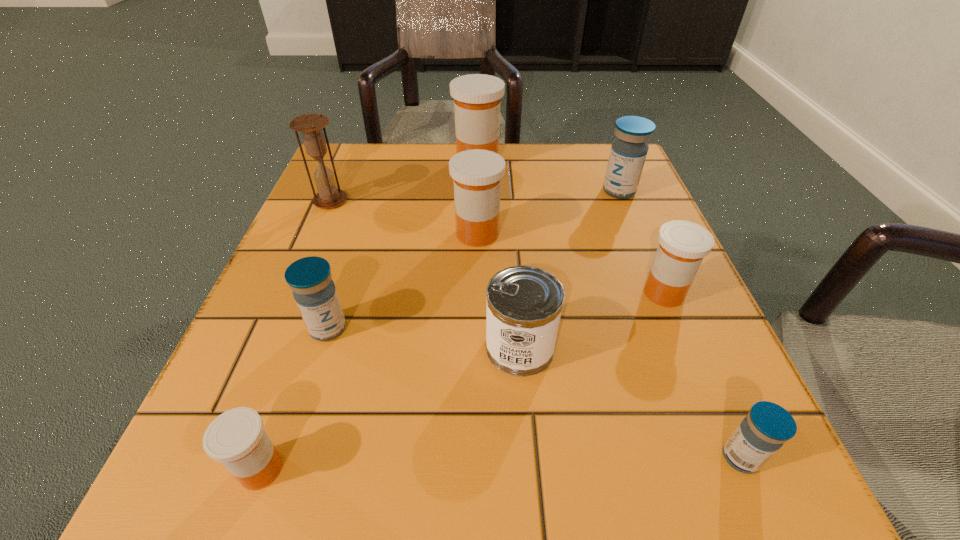
Identify the location of vacant space in between the second farthest orange medicine and the nearest blue medicine. The image size is (960, 540). (609, 346).

Where is `vacant space that's between the biggest orange medicine and the leftmost blue medicine`? Image resolution: width=960 pixels, height=540 pixels. vacant space that's between the biggest orange medicine and the leftmost blue medicine is located at coordinates (403, 245).

Where is `free space between the nearest blue medicine and the fifth nearest medicine`? The width and height of the screenshot is (960, 540). free space between the nearest blue medicine and the fifth nearest medicine is located at coordinates (609, 346).

I want to click on empty space between the farthest blue medicine and the third smallest orange medicine, so click(x=548, y=212).

The image size is (960, 540). Identify the location of vacant region between the third smallest orange medicine and the third farthest orange medicine. (570, 264).

Find the location of a particular element. This screenshot has width=960, height=540. free space between the third nearest medicine and the tallest medicine is located at coordinates (403, 245).

What are the coordinates of `unoccupied position between the can and the third biggest orange medicine` in the screenshot? It's located at (592, 320).

I want to click on vacant space that's between the hourglass and the tallest medicine, so click(404, 181).

Point out which object is positioned as the fifth nearest to the smallest blue medicine. Please provide its 2D coordinates. Your answer should be formatted as a tuple, i.e. [(x, y)], where the tuple contains the x and y coordinates of a point satisfying the conditions above.

[(628, 152)]

Where is `object that is the seventh closest one to the can`? object that is the seventh closest one to the can is located at coordinates (310, 125).